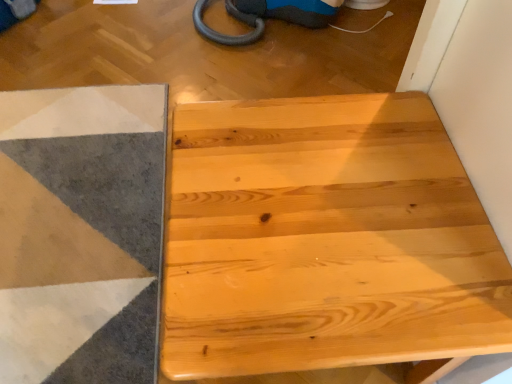
The height and width of the screenshot is (384, 512). I want to click on free spot below soft gray carpet at lower left (from a real-world perspective), so click(x=67, y=253).